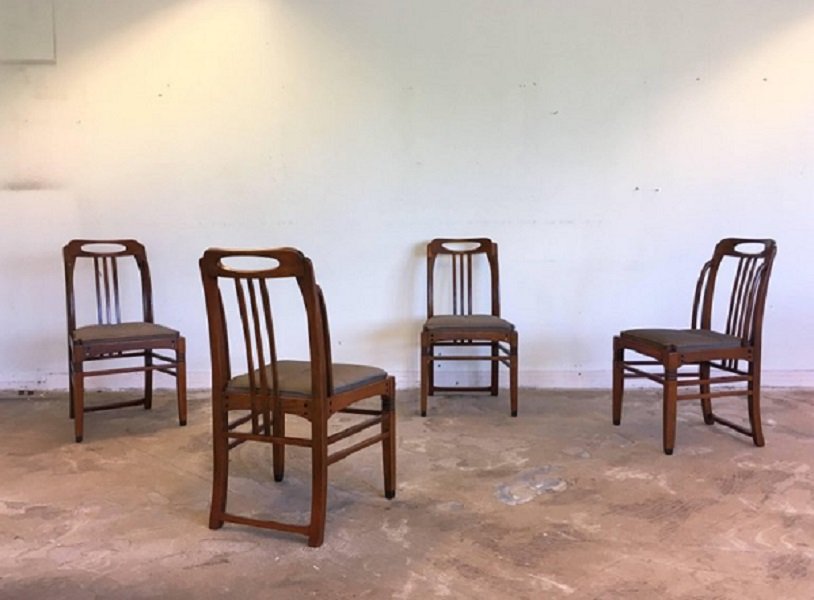
Find the location of `wooden chairs with cushioned seats`. wooden chairs with cushioned seats is located at coordinates (313, 382), (130, 344), (458, 336), (689, 362).